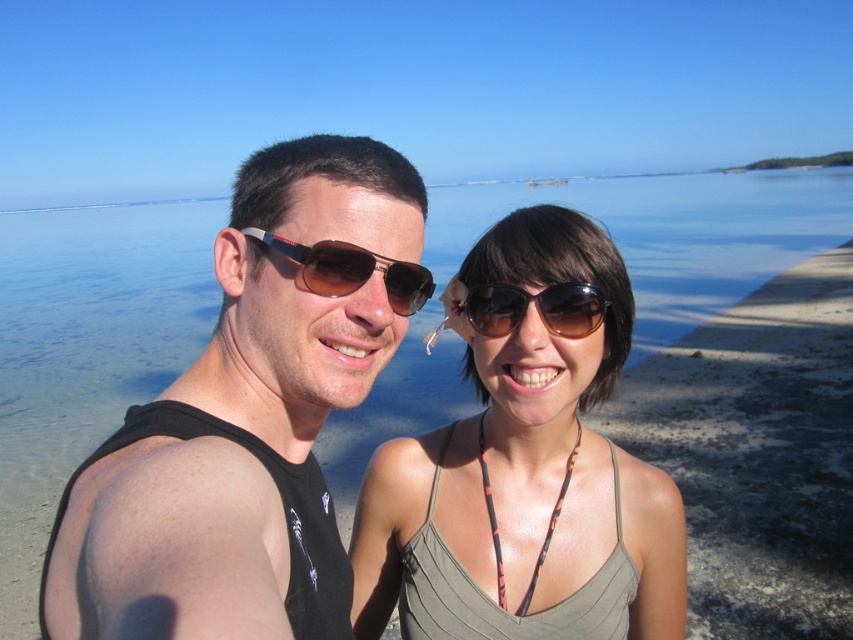
Which is more to the left, sunglasses at center or brown reflective sunglasses at center?

sunglasses at center is more to the left.

At what (x,y) coordinates should I click in order to perform the action: click on sunglasses at center. Please return your answer as a coordinate pair (x, y). The image size is (853, 640). Looking at the image, I should click on click(351, 269).

Can you confirm if black matte tank top at center is positioned to the right of brown reflective sunglasses at center?

No, black matte tank top at center is not to the right of brown reflective sunglasses at center.

Identify the location of black matte tank top at center. (248, 417).

Which is more to the left, matte gray tank top at center or brown reflective sunglasses at center?

brown reflective sunglasses at center

Does point (469, 278) lie in front of point (490, 310)?

No, it is not.

Between point (480, 259) and point (585, 310), which one is positioned in front?

Point (585, 310)

You are a GUI agent. You are given a task and a screenshot of the screen. Output one action in this format:
    pyautogui.click(x=<x>, y=<y>)
    Task: Click on the matte gray tank top at center
    
    Given the screenshot: What is the action you would take?
    pyautogui.click(x=525, y=465)